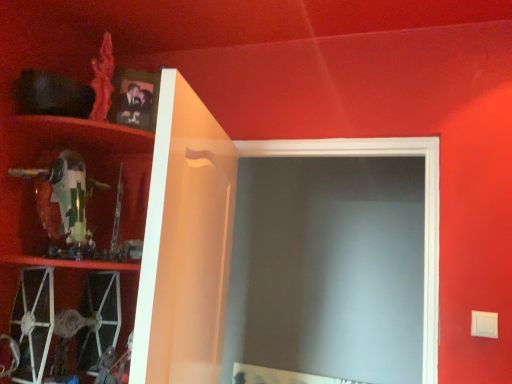
At what (x,y) coordinates should I click in order to perform the action: click on matte black photo frame at upper left. Please return your answer as a coordinate pair (x, y). The image size is (512, 384). Looking at the image, I should click on (134, 99).

I want to click on white glossy cabinet at upper left, which is the 1th cabinet from right to left, so [x=120, y=242].

Considering the relative sizes of matte black photo frame at upper left and green plastic toy at left, the 2th cabinet from the right, in the image provided, is matte black photo frame at upper left wider than green plastic toy at left, the 2th cabinet from the right,?

Incorrect, the width of matte black photo frame at upper left does not surpass that of green plastic toy at left, the 2th cabinet from the right.

Is matte black photo frame at upper left bigger or smaller than green plastic toy at left, placed as the second cabinet when sorted from left to right?

Clearly, matte black photo frame at upper left is smaller in size than green plastic toy at left, placed as the second cabinet when sorted from left to right.

Do you think matte black photo frame at upper left is within green plastic toy at left, the 2th cabinet from the right, or outside of it?

matte black photo frame at upper left is spatially situated outside green plastic toy at left, the 2th cabinet from the right.

From a real-world perspective, which object rests below the other?

white glossy cabinet at upper left, which is the 1th cabinet from right to left, is physically lower.

From the image's perspective, is green plastic toy at left, placed as the second cabinet when sorted from left to right, located above white glossy cabinet at upper left, which is the 1th cabinet from right to left?

Yes.

Which object is wider, green plastic toy at left, placed as the second cabinet when sorted from left to right, or white glossy cabinet at upper left, which is the 1th cabinet from right to left?

With larger width is green plastic toy at left, placed as the second cabinet when sorted from left to right.

From the picture: Between matte black photo frame at upper left and white glossy cabinet at upper left, acting as the third cabinet starting from the left, which one has less height?

matte black photo frame at upper left is shorter.

Is matte black photo frame at upper left facing away from white glossy cabinet at upper left, acting as the third cabinet starting from the left?

matte black photo frame at upper left does not have its back to white glossy cabinet at upper left, acting as the third cabinet starting from the left.

From a real-world perspective, is matte black photo frame at upper left positioned above or below white glossy cabinet at upper left, acting as the third cabinet starting from the left?

matte black photo frame at upper left is situated higher than white glossy cabinet at upper left, acting as the third cabinet starting from the left, in the real world.

Which of these two, matte black photo frame at upper left or white glossy cabinet at upper left, which is the 1th cabinet from right to left, is bigger?

With larger size is white glossy cabinet at upper left, which is the 1th cabinet from right to left.

Can you confirm if white glossy cabinet at upper left, acting as the third cabinet starting from the left, is thinner than green plastic toy at left, placed as the second cabinet when sorted from left to right?

Indeed, white glossy cabinet at upper left, acting as the third cabinet starting from the left, has a lesser width compared to green plastic toy at left, placed as the second cabinet when sorted from left to right.

Which is in front, point (47, 164) or point (136, 248)?

The point (136, 248) is more forward.

From the image's perspective, which one is positioned lower, white glossy cabinet at upper left, acting as the third cabinet starting from the left, or green plastic toy at left, placed as the second cabinet when sorted from left to right?

white glossy cabinet at upper left, acting as the third cabinet starting from the left, appears lower in the image.

Is white glossy cabinet at upper left, which is the 1th cabinet from right to left, positioned far away from green plastic toy at left, placed as the second cabinet when sorted from left to right?

white glossy cabinet at upper left, which is the 1th cabinet from right to left, is actually quite close to green plastic toy at left, placed as the second cabinet when sorted from left to right.

Consider the image. Can you confirm if white glossy cabinet at upper left, which is the 1th cabinet from right to left, is bigger than matte black photo frame at upper left?

Yes.

Is the surface of white glossy cabinet at upper left, which is the 1th cabinet from right to left, in direct contact with matte black photo frame at upper left?

No.

Can you tell me how much white glossy cabinet at upper left, which is the 1th cabinet from right to left, and matte black photo frame at upper left differ in facing direction?

The facing directions of white glossy cabinet at upper left, which is the 1th cabinet from right to left, and matte black photo frame at upper left are 75 degrees apart.

Choose the correct answer: Is white glossy cabinet at upper left, acting as the third cabinet starting from the left, inside matte black photo frame at upper left or outside it?

white glossy cabinet at upper left, acting as the third cabinet starting from the left, is not enclosed by matte black photo frame at upper left.

Is metallic silver tie fighter at lower left, the 1th cabinet from the left, wider than white glossy cabinet at upper left, which is the 1th cabinet from right to left?

Yes.

This screenshot has width=512, height=384. I want to click on cabinet below the white glossy cabinet at upper left, acting as the third cabinet starting from the left (from the image's perspective), so click(x=67, y=323).

Are metallic silver tie fighter at lower left, the 1th cabinet from the left, and white glossy cabinet at upper left, which is the 1th cabinet from right to left, located far from each other?

Actually, metallic silver tie fighter at lower left, the 1th cabinet from the left, and white glossy cabinet at upper left, which is the 1th cabinet from right to left, are a little close together.

Is metallic silver tie fighter at lower left, which is counted as the 3th cabinet, starting from the right, to the right of white glossy cabinet at upper left, which is the 1th cabinet from right to left, from the viewer's perspective?

No.

Does green plastic toy at left, the 2th cabinet from the right, have a smaller size compared to matte black photo frame at upper left?

No.

Is green plastic toy at left, the 2th cabinet from the right, further to camera compared to matte black photo frame at upper left?

No, green plastic toy at left, the 2th cabinet from the right, is closer to the camera.

In the image, there is a green plastic toy at left, placed as the second cabinet when sorted from left to right. Where is `picture frame above it (from the image's perspective)`? The width and height of the screenshot is (512, 384). picture frame above it (from the image's perspective) is located at coordinates (134, 99).

Can you see green plastic toy at left, placed as the second cabinet when sorted from left to right, touching matte black photo frame at upper left?

They are not placed beside each other.

The width and height of the screenshot is (512, 384). I want to click on cabinet that is the 1st one when counting forward from the matte black photo frame at upper left, so click(x=83, y=190).

Where is `cabinet on the right of green plastic toy at left, placed as the second cabinet when sorted from left to right`? cabinet on the right of green plastic toy at left, placed as the second cabinet when sorted from left to right is located at coordinates (120, 242).

Looking at the image, which one is located further to matte black photo frame at upper left, metallic silver tie fighter at lower left, the 1th cabinet from the left, or white glossy cabinet at upper left, which is the 1th cabinet from right to left?

Based on the image, metallic silver tie fighter at lower left, the 1th cabinet from the left, appears to be further to matte black photo frame at upper left.

Which object lies nearer to the anchor point white glossy cabinet at upper left, acting as the third cabinet starting from the left, matte black photo frame at upper left or green plastic toy at left, the 2th cabinet from the right?

Based on the image, green plastic toy at left, the 2th cabinet from the right, appears to be nearer to white glossy cabinet at upper left, acting as the third cabinet starting from the left.

Based on their spatial positions, is white glossy cabinet at upper left, acting as the third cabinet starting from the left, or green plastic toy at left, the 2th cabinet from the right, further from matte black photo frame at upper left?

white glossy cabinet at upper left, acting as the third cabinet starting from the left, is further to matte black photo frame at upper left.

When comparing their distances from green plastic toy at left, the 2th cabinet from the right, does matte black photo frame at upper left or white glossy cabinet at upper left, acting as the third cabinet starting from the left, seem further?

The object further to green plastic toy at left, the 2th cabinet from the right, is matte black photo frame at upper left.

Which object lies nearer to the anchor point matte black photo frame at upper left, green plastic toy at left, placed as the second cabinet when sorted from left to right, or white glossy cabinet at upper left, which is the 1th cabinet from right to left?

green plastic toy at left, placed as the second cabinet when sorted from left to right, is positioned closer to the anchor matte black photo frame at upper left.

Looking at the image, which one is located further to green plastic toy at left, the 2th cabinet from the right, metallic silver tie fighter at lower left, which is counted as the 3th cabinet, starting from the right, or matte black photo frame at upper left?

matte black photo frame at upper left is positioned further to the anchor green plastic toy at left, the 2th cabinet from the right.

Considering their positions, is green plastic toy at left, the 2th cabinet from the right, positioned further to matte black photo frame at upper left than metallic silver tie fighter at lower left, which is counted as the 3th cabinet, starting from the right?

metallic silver tie fighter at lower left, which is counted as the 3th cabinet, starting from the right.

Which object lies nearer to the anchor point metallic silver tie fighter at lower left, which is counted as the 3th cabinet, starting from the right, white glossy cabinet at upper left, which is the 1th cabinet from right to left, or green plastic toy at left, placed as the second cabinet when sorted from left to right?

white glossy cabinet at upper left, which is the 1th cabinet from right to left, is closer to metallic silver tie fighter at lower left, which is counted as the 3th cabinet, starting from the right.

Where is `cabinet between metallic silver tie fighter at lower left, the 1th cabinet from the left, and white glossy cabinet at upper left, which is the 1th cabinet from right to left, from left to right`? cabinet between metallic silver tie fighter at lower left, the 1th cabinet from the left, and white glossy cabinet at upper left, which is the 1th cabinet from right to left, from left to right is located at coordinates (83, 190).